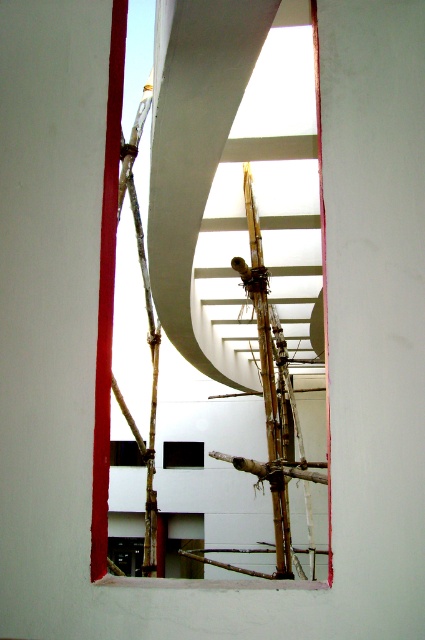
Question: Which point is farther from the camera taking this photo?

Choices:
 (A) (124, 458)
 (B) (195, 461)

Answer: (A)

Question: Which object is closer to the camera taking this photo?

Choices:
 (A) transparent plastic hole at center
 (B) transparent glass hole at lower center

Answer: (B)

Question: Does transparent plastic hole at center have a smaller size compared to transparent glass hole at lower center?

Choices:
 (A) no
 (B) yes

Answer: (B)

Question: Which object is closer to the camera taking this photo?

Choices:
 (A) transparent plastic hole at center
 (B) transparent glass hole at lower center

Answer: (B)

Question: Is transparent plastic hole at center smaller than transparent glass hole at lower center?

Choices:
 (A) no
 (B) yes

Answer: (B)

Question: Observing the image, what is the correct spatial positioning of transparent plastic hole at center in reference to transparent glass hole at lower center?

Choices:
 (A) right
 (B) left

Answer: (A)